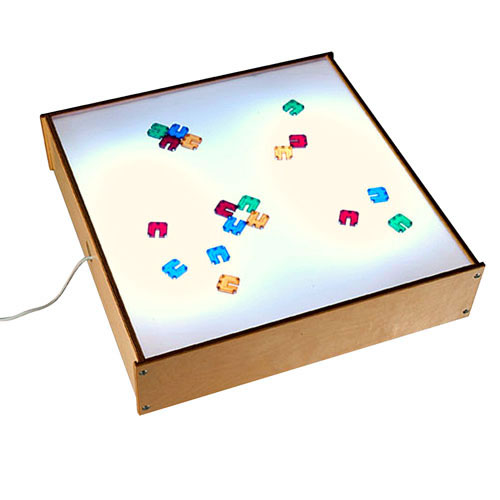
Identify the location of upper right light box corner. The width and height of the screenshot is (500, 500). (327, 53).